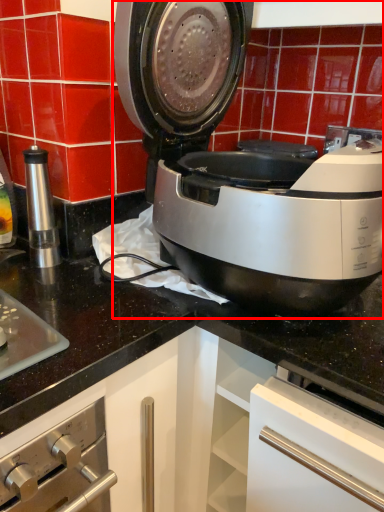
Question: From the image, what is the correct spatial relationship of home appliance (annotated by the red box) in relation to kitchen appliance?

Choices:
 (A) left
 (B) right

Answer: (B)